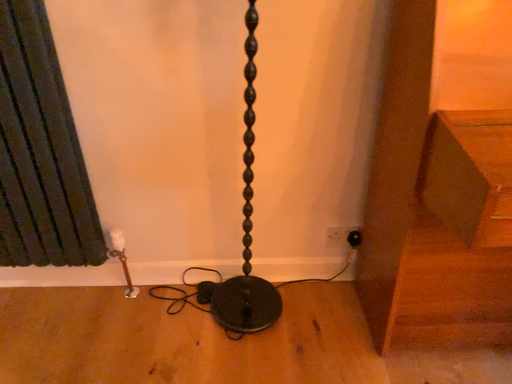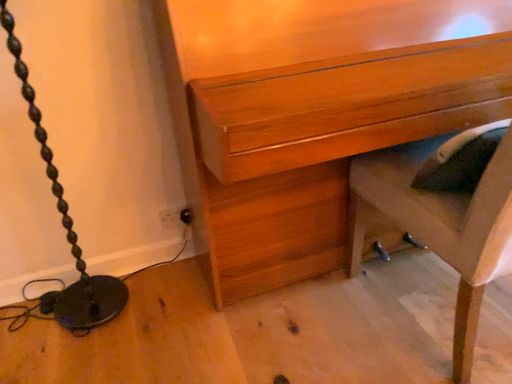
Question: Which way did the camera rotate in the video?

Choices:
 (A) rotated left
 (B) rotated right

Answer: (B)